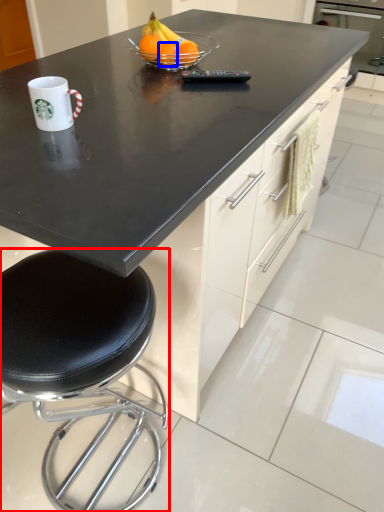
Question: Which object is further to the camera taking this photo, stool (highlighted by a red box) or orange (highlighted by a blue box)?

Choices:
 (A) stool
 (B) orange

Answer: (B)